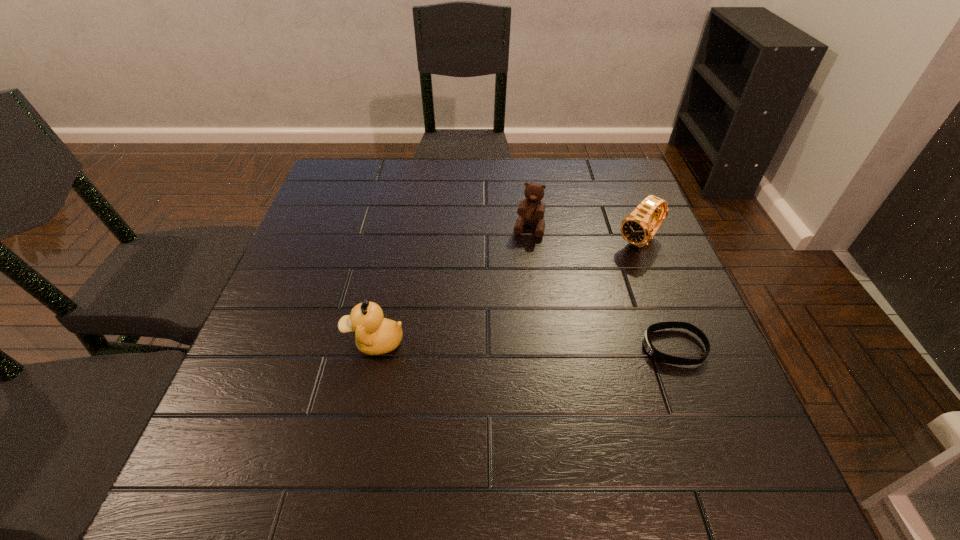
The image size is (960, 540). Find the location of `vacant space on the desktop that is between the leftmost object and the shortest object and is positioned on the face of the teddy bear`. vacant space on the desktop that is between the leftmost object and the shortest object and is positioned on the face of the teddy bear is located at coordinates (494, 345).

The image size is (960, 540). Identify the location of vacant spot on the desktop that is between the leftmost object and the wristband and is positioned on the face of the watch. (518, 345).